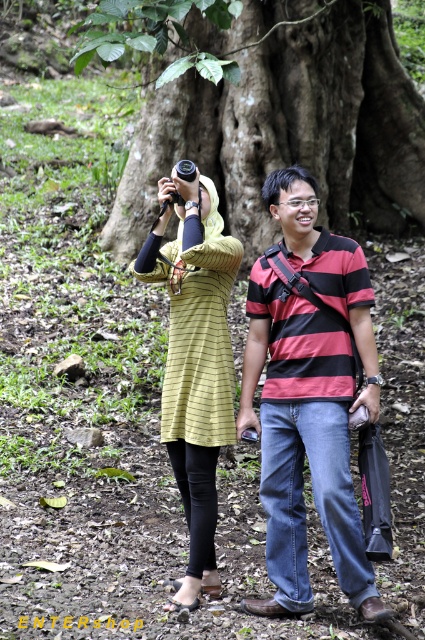
Is green rough bark tree at center further to camera compared to yellow striped dress at upper left?

Yes.

Is point (261, 96) less distant than point (192, 248)?

No, it is behind (192, 248).

The height and width of the screenshot is (640, 425). Identify the location of green rough bark tree at center. (274, 115).

In order to click on green rough bark tree at center in this screenshot , I will do `click(274, 115)`.

Is striped cotton shirt at center further to the viewer compared to yellow striped dress at upper left?

No.

Between striped cotton shirt at center and yellow striped dress at upper left, which one appears on the left side from the viewer's perspective?

yellow striped dress at upper left

Is point (311, 216) positioned after point (181, 259)?

No, it is in front of (181, 259).

Image resolution: width=425 pixels, height=640 pixels. Find the location of `striped cotton shirt at center`. striped cotton shirt at center is located at coordinates (308, 397).

Which is more to the right, green rough bark tree at center or striped cotton shirt at center?

Positioned to the right is green rough bark tree at center.

Image resolution: width=425 pixels, height=640 pixels. Describe the element at coordinates (274, 115) in the screenshot. I see `green rough bark tree at center` at that location.

Identify the location of green rough bark tree at center. The image size is (425, 640). (274, 115).